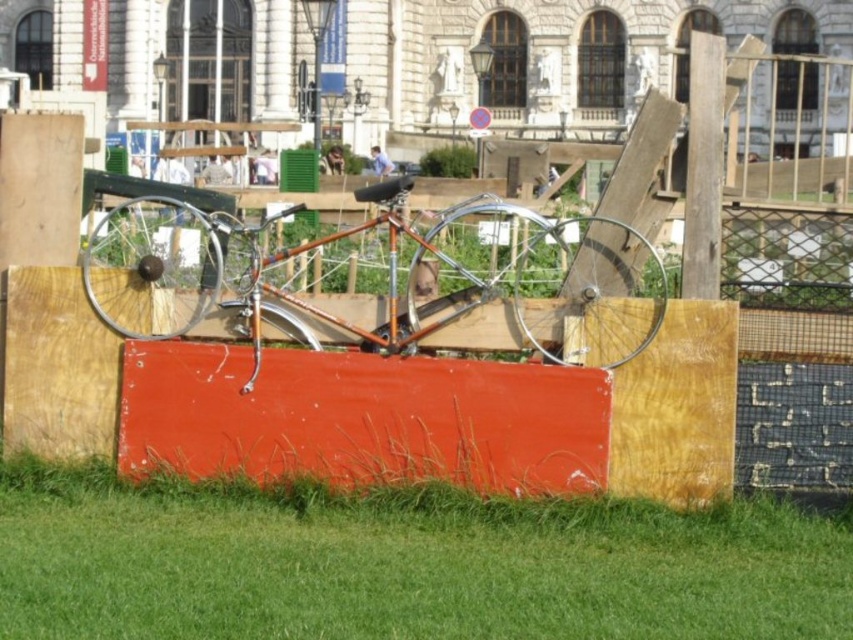
Question: Observing the image, what is the correct spatial positioning of green grass at lower center in reference to shiny orange bicycle at center?

Choices:
 (A) right
 (B) left

Answer: (A)

Question: Which of the following is the closest to the observer?

Choices:
 (A) (374, 561)
 (B) (585, 358)

Answer: (A)

Question: Which object appears closest to the camera in this image?

Choices:
 (A) green grass at lower center
 (B) shiny orange bicycle at center

Answer: (A)

Question: Can you confirm if green grass at lower center is wider than shiny orange bicycle at center?

Choices:
 (A) yes
 (B) no

Answer: (A)

Question: Is green grass at lower center closer to the viewer compared to shiny orange bicycle at center?

Choices:
 (A) yes
 (B) no

Answer: (A)